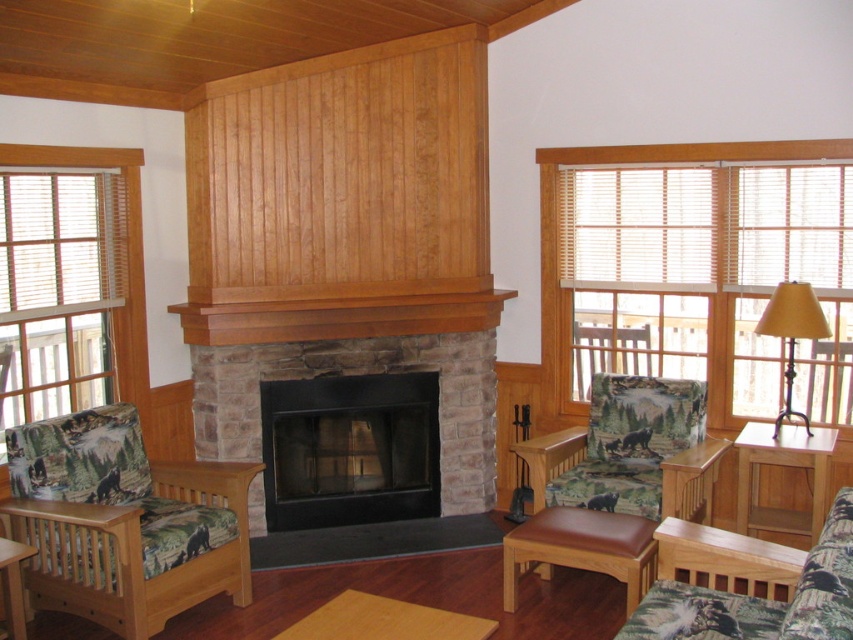
Question: Is light wood/texture side table at lower right to the left of metallic gold lampshade at right from the viewer's perspective?

Choices:
 (A) yes
 (B) no

Answer: (A)

Question: Among these objects, which one is farthest from the camera?

Choices:
 (A) light wood/texture side table at lower right
 (B) printed fabric armchair at left
 (C) metallic gold lampshade at right

Answer: (C)

Question: Can you confirm if camouflage fabric couch at lower right is thinner than brown leather stool at center?

Choices:
 (A) yes
 (B) no

Answer: (B)

Question: Which object is farther from the camera taking this photo?

Choices:
 (A) metallic gold lampshade at right
 (B) light wood/texture side table at lower right
 (C) camouflage fabric couch at lower right
 (D) printed fabric armchair at left

Answer: (A)

Question: Estimate the real-world distances between objects in this image. Which object is closer to the brown leather stool at center?

Choices:
 (A) metallic gold lampshade at right
 (B) black matte fireplace at center
 (C) printed fabric armchair at left
 (D) camouflage fabric couch at lower right

Answer: (D)

Question: Can you confirm if printed fabric armchair at left is wider than brown leather stool at center?

Choices:
 (A) yes
 (B) no

Answer: (A)